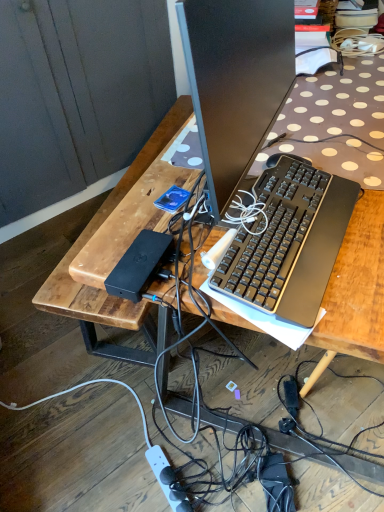
What are the coordinates of `black plastic keyboard at center` in the screenshot? It's located at (289, 242).

Where is `wooden desk at center`? The width and height of the screenshot is (384, 512). wooden desk at center is located at coordinates pyautogui.click(x=101, y=289).

Measure the distance between white plastic power outlet at lower center and camera.

white plastic power outlet at lower center and camera are 3.95 feet apart from each other.

You are a GUI agent. You are given a task and a screenshot of the screen. Output one action in this format:
    pyautogui.click(x=<x>, y=<y>)
    Task: Click on the black plastic keyboard at center
    The width and height of the screenshot is (384, 512).
    Given the screenshot: What is the action you would take?
    pyautogui.click(x=289, y=242)

Relative to white plastic power outlet at lower center, is black plastic keyboard at center in front or behind?

black plastic keyboard at center is in front of white plastic power outlet at lower center.

Which of these two, black plastic keyboard at center or white plastic power outlet at lower center, is wider?

white plastic power outlet at lower center is wider.

In the scene shown: Choose the correct answer: Is black plastic keyboard at center inside white plastic power outlet at lower center or outside it?

The correct answer is: outside.

Looking at this image, from the image's perspective, is black plastic keyboard at center positioned above or below white plastic power outlet at lower center?

black plastic keyboard at center is situated higher than white plastic power outlet at lower center in the image.

Could black plastic keyboard at center be considered to be inside white plastic power outlet at lower center?

Actually, black plastic keyboard at center is outside white plastic power outlet at lower center.

Which is behind, point (181, 511) or point (237, 288)?

The point (181, 511) is farther.

Does white plastic power outlet at lower center have a smaller size compared to black plastic keyboard at center?

Indeed, white plastic power outlet at lower center has a smaller size compared to black plastic keyboard at center.

Measure the distance from white plastic power outlet at lower center to wooden desk at center.

white plastic power outlet at lower center is 28.04 inches away from wooden desk at center.

Is white plastic power outlet at lower center not near wooden desk at center?

Actually, white plastic power outlet at lower center and wooden desk at center are a little close together.

Find the location of `desk in front of the white plastic power outlet at lower center`. desk in front of the white plastic power outlet at lower center is located at coordinates (101, 289).

Which is correct: white plastic power outlet at lower center is inside wooden desk at center, or outside of it?

white plastic power outlet at lower center lies outside wooden desk at center.

From the image's perspective, between wooden desk at center and black plastic keyboard at center, which one is located above?

wooden desk at center, from the image's perspective.

Would you say wooden desk at center is inside or outside black plastic keyboard at center?

wooden desk at center cannot be found inside black plastic keyboard at center.

Can you tell me how much wooden desk at center and black plastic keyboard at center differ in facing direction?

The angular difference between wooden desk at center and black plastic keyboard at center is 4.29 degrees.

Does wooden desk at center lie in front of black plastic keyboard at center?

That is True.

Is wooden desk at center not within white plastic power outlet at lower center?

Indeed, wooden desk at center is completely outside white plastic power outlet at lower center.

Which object is more forward, wooden desk at center or white plastic power outlet at lower center?

Positioned in front is wooden desk at center.

Between wooden desk at center and white plastic power outlet at lower center, which one has larger width?

wooden desk at center.

From the image's perspective, is wooden desk at center located above or below white plastic power outlet at lower center?

Clearly, from the image's perspective, wooden desk at center is above white plastic power outlet at lower center.

Considering the positions of points (292, 262) and (53, 290), is point (292, 262) closer to camera compared to point (53, 290)?

Yes.

This screenshot has height=512, width=384. Find the location of `desk above the black plastic keyboard at center (from the image's perspective)`. desk above the black plastic keyboard at center (from the image's perspective) is located at coordinates (101, 289).

From the image's perspective, would you say black plastic keyboard at center is positioned over wooden desk at center?

Incorrect, from the image's perspective, black plastic keyboard at center is lower than wooden desk at center.

Can you confirm if black plastic keyboard at center is bigger than wooden desk at center?

Incorrect, black plastic keyboard at center is not larger than wooden desk at center.

Identify the location of power outlet on the left of black plastic keyboard at center. The image size is (384, 512). (161, 479).

This screenshot has width=384, height=512. I want to click on computer keyboard above the white plastic power outlet at lower center (from the image's perspective), so coord(289,242).

From the picture: Looking at the image, which one is located further to black plastic keyboard at center, wooden desk at center or white plastic power outlet at lower center?

white plastic power outlet at lower center is positioned further to the anchor black plastic keyboard at center.

When comparing their distances from white plastic power outlet at lower center, does black plastic keyboard at center or wooden desk at center seem closer?

Among the two, wooden desk at center is located nearer to white plastic power outlet at lower center.

Considering their positions, is white plastic power outlet at lower center positioned closer to wooden desk at center than black plastic keyboard at center?

black plastic keyboard at center is positioned closer to the anchor wooden desk at center.

Which object lies nearer to the anchor point white plastic power outlet at lower center, wooden desk at center or black plastic keyboard at center?

wooden desk at center is closer to white plastic power outlet at lower center.

Looking at this image, which object lies nearer to the anchor point black plastic keyboard at center, white plastic power outlet at lower center or wooden desk at center?

wooden desk at center is closer to black plastic keyboard at center.

Based on the photo, looking at the image, which one is located further to wooden desk at center, black plastic keyboard at center or white plastic power outlet at lower center?

white plastic power outlet at lower center is further to wooden desk at center.

At what (x,y) coordinates should I click in order to perform the action: click on computer keyboard between wooden desk at center and white plastic power outlet at lower center from top to bottom. Please return your answer as a coordinate pair (x, y). The height and width of the screenshot is (512, 384). Looking at the image, I should click on (289, 242).